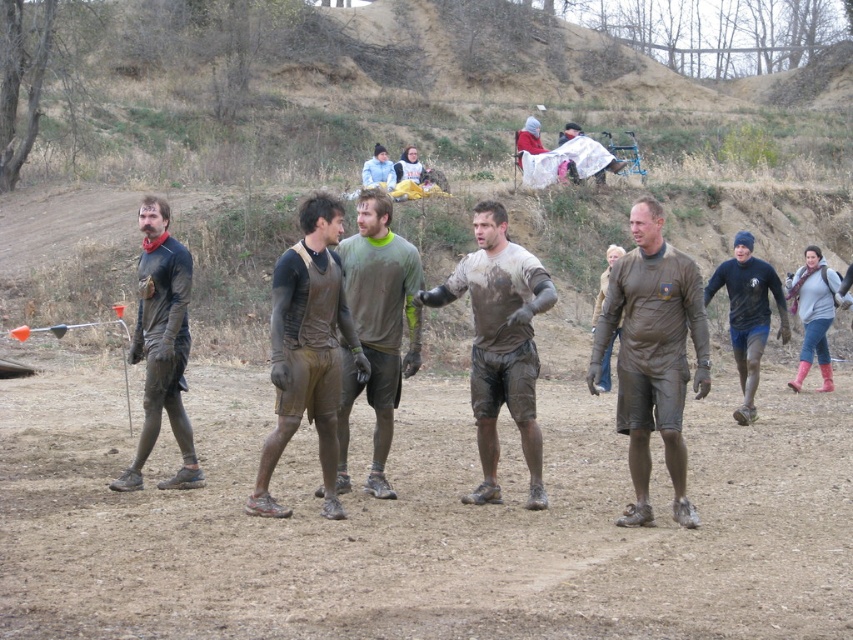
You are a photographer at the mud run event. You need to take a photo that includes both the matte black outfit at left and the dark blue jersey at right. Based on their positions, which one should you focus on first to ensure both are in frame?

The matte black outfit at left is positioned on the left side of dark blue jersey at right, so you should focus on the matte black outfit at left first to ensure both are in frame.

You are a participant in the mud run event and you want to find the matte black outfit at left. Where should you look?

The matte black outfit at left is located at point 0.541 on the x axis and 0.190 on the y axis.